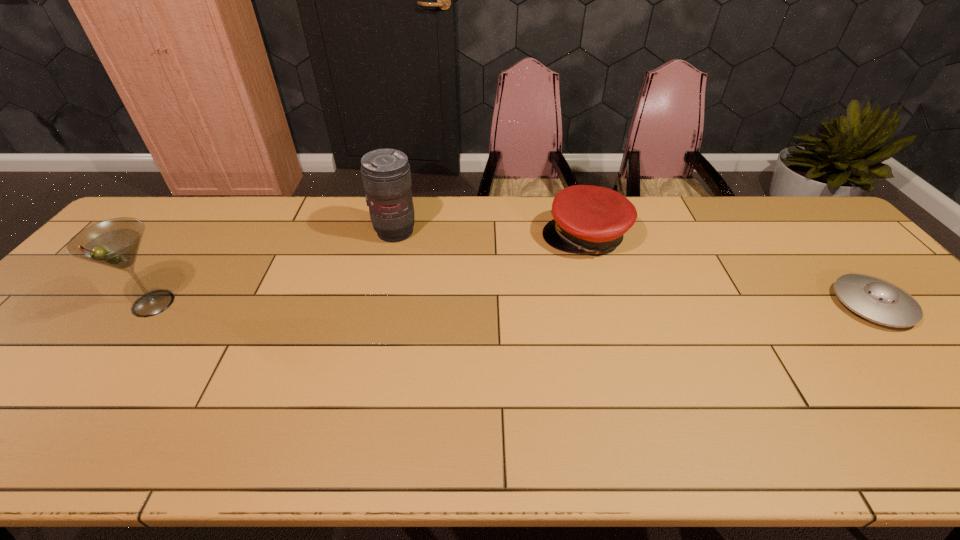
The image size is (960, 540). In order to click on free space between the telephoto lens and the saucer in this screenshot , I will do click(x=634, y=268).

Where is `vacant space in between the third tallest object and the martini`? The width and height of the screenshot is (960, 540). vacant space in between the third tallest object and the martini is located at coordinates (370, 271).

This screenshot has width=960, height=540. I want to click on vacant point located between the saucer and the martini, so click(513, 304).

I want to click on free space between the martini and the second shortest object, so click(370, 271).

Find the location of a particular element. free space between the saucer and the second object from left to right is located at coordinates (634, 268).

Locate an element on the screen. This screenshot has height=540, width=960. free point between the rightmost object and the third tallest object is located at coordinates (729, 271).

Identify the location of free space between the martini and the rightmost object. (513, 304).

At what (x,y) coordinates should I click in order to perform the action: click on vacant space that's between the shortest object and the leftmost object. Please return your answer as a coordinate pair (x, y). The image size is (960, 540). Looking at the image, I should click on (513, 304).

Locate an element on the screen. free space between the shortest object and the leftmost object is located at coordinates (513, 304).

Find the location of a particular element. object that is the third closest to the shortest object is located at coordinates (115, 242).